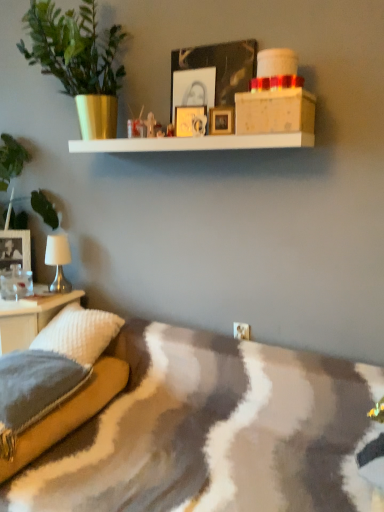
Question: Based on their sizes in the image, would you say white glossy table at lower left is bigger or smaller than green matte plant at left?

Choices:
 (A) small
 (B) big

Answer: (A)

Question: Considering the positions of white glossy table at lower left and green matte plant at left in the image, is white glossy table at lower left wider or thinner than green matte plant at left?

Choices:
 (A) wide
 (B) thin

Answer: (B)

Question: Which object is positioned farthest from the wooden picture frame at upper center, arranged as the third picture frame when viewed from the right?

Choices:
 (A) white matte table lamp at left
 (B) white glossy table at lower left
 (C) gold metallic picture frame at upper center, which is the third picture frame in left-to-right order
 (D) textured gray pillow at lower left, the second pillow when ordered from back to front
 (E) black matte picture frame at left, arranged as the 1th picture frame when ordered from the bottom

Answer: (E)

Question: Considering the real-world distances, which object is farthest from the gold metallic picture frame at upper center, the 3th picture frame in the front-to-back sequence?

Choices:
 (A) white textured box at upper center
 (B) textured gray pillow at lower left, the 1th pillow positioned from the front
 (C) black matte picture frame at left, placed as the fourth picture frame when sorted from top to bottom
 (D) white textured pillow at lower left, the 1th pillow viewed from the back
 (E) green leafy plant at left

Answer: (B)